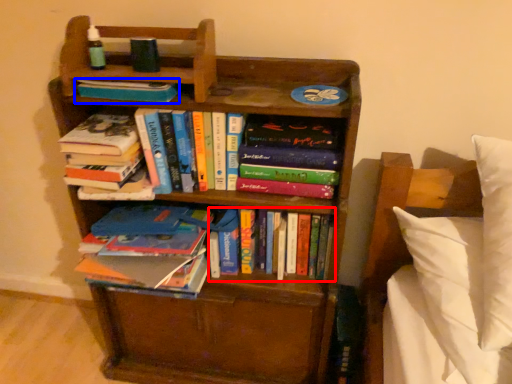
Question: Which of the following is the farthest to the observer, book (highlighted by a red box) or book (highlighted by a blue box)?

Choices:
 (A) book
 (B) book

Answer: (A)